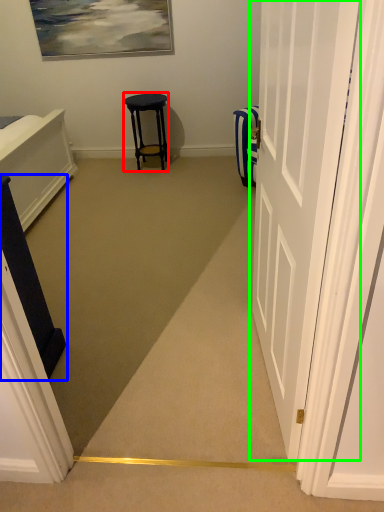
Question: Which object is positioned closest to stool (highlighted by a red box)? Select from furniture (highlighted by a blue box) and door (highlighted by a green box).

Choices:
 (A) furniture
 (B) door

Answer: (A)